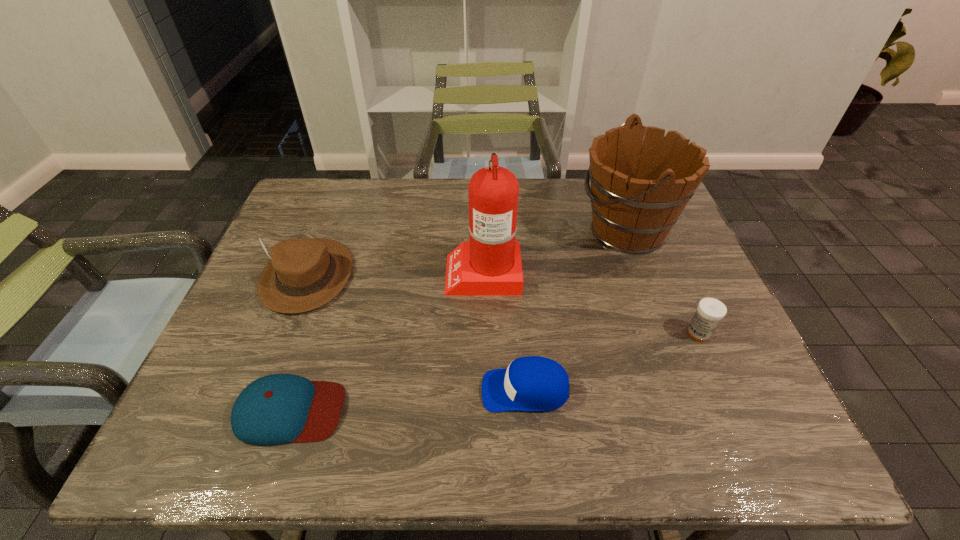
In the image, there is a desktop. Identify the location of vacant area at the left edge. This screenshot has width=960, height=540. (288, 318).

Locate an element on the screen. The image size is (960, 540). vacant area at the right edge of the desktop is located at coordinates (736, 356).

Where is `vacant space at the far left corner of the desktop`? vacant space at the far left corner of the desktop is located at coordinates (296, 201).

This screenshot has width=960, height=540. In order to click on vacant area at the near left corner in this screenshot , I will do `click(208, 444)`.

Where is `vacant area between the shorter baseball cap and the third tallest object`? This screenshot has height=540, width=960. vacant area between the shorter baseball cap and the third tallest object is located at coordinates click(x=299, y=343).

Locate an element on the screen. free space between the tallest object and the second tallest object is located at coordinates (555, 251).

Where is `vacant region between the wine bucket and the tallest object`? vacant region between the wine bucket and the tallest object is located at coordinates click(555, 251).

Locate an element on the screen. vacant area that lies between the fire extinguisher and the third shortest object is located at coordinates (591, 302).

This screenshot has height=540, width=960. Find the location of `empty space that is in between the third nearest object and the tallest object`. empty space that is in between the third nearest object and the tallest object is located at coordinates (591, 302).

Image resolution: width=960 pixels, height=540 pixels. What are the coordinates of `free point between the tallest object and the right baseball cap` in the screenshot? It's located at (504, 331).